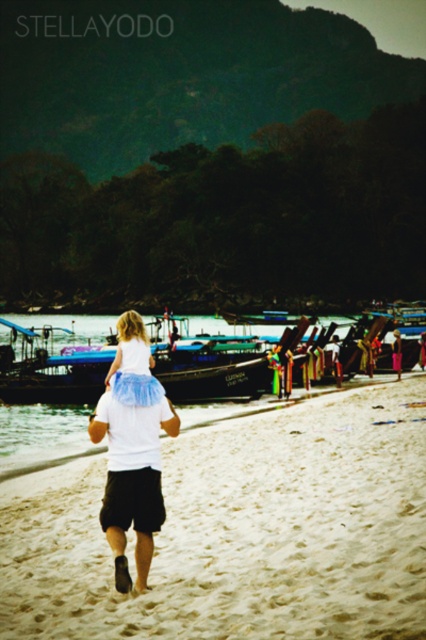
Question: Estimate the real-world distances between objects in this image. Which object is closer to the wooden boat at center?

Choices:
 (A) white sandy beach at center
 (B) white matte shirt at center

Answer: (A)

Question: Which point appears closest to the camera in this image?

Choices:
 (A) (143, 337)
 (B) (28, 480)
 (C) (310, 323)
 (D) (140, 492)

Answer: (D)

Question: Does white matte shirt at center have a larger size compared to white tulle skirt at center?

Choices:
 (A) no
 (B) yes

Answer: (B)

Question: Is wooden boat at center positioned before white tulle skirt at center?

Choices:
 (A) no
 (B) yes

Answer: (A)

Question: Which object appears closest to the camera in this image?

Choices:
 (A) wooden boat at center
 (B) white matte shirt at center
 (C) white sandy beach at center
 (D) white tulle skirt at center

Answer: (C)

Question: Does white sandy beach at center appear under wooden boat at center?

Choices:
 (A) no
 (B) yes

Answer: (B)